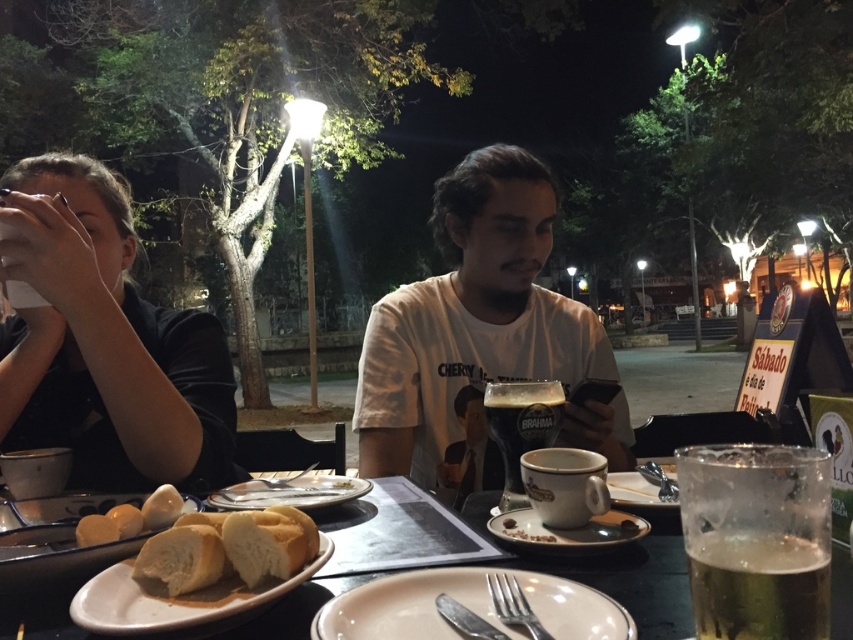
You are a waiter at the outdoor dining area. You need to deliver a drink to the customer wearing the black matte shirt at left. The drink is placed on the table at the dark amber glass at center. Can you reach the drink without moving the glass?

The black matte shirt at left and dark amber glass at center are 50.81 centimeters apart. Since the distance between them is sufficient, you can reach the drink placed at the dark amber glass at center without needing to move the glass itself.

You are a food delivery person who needs to place a hot dish on the matte ceramic plate at center. The dish is too hot to touch, and you have a 16 inch long utensil. Can you safely place the dish on the plate without burning yourself?

The matte ceramic plate at center is 18.73 inches from viewer. The utensil is 16 inches long, so it is not long enough to reach the plate safely. You need a longer utensil.